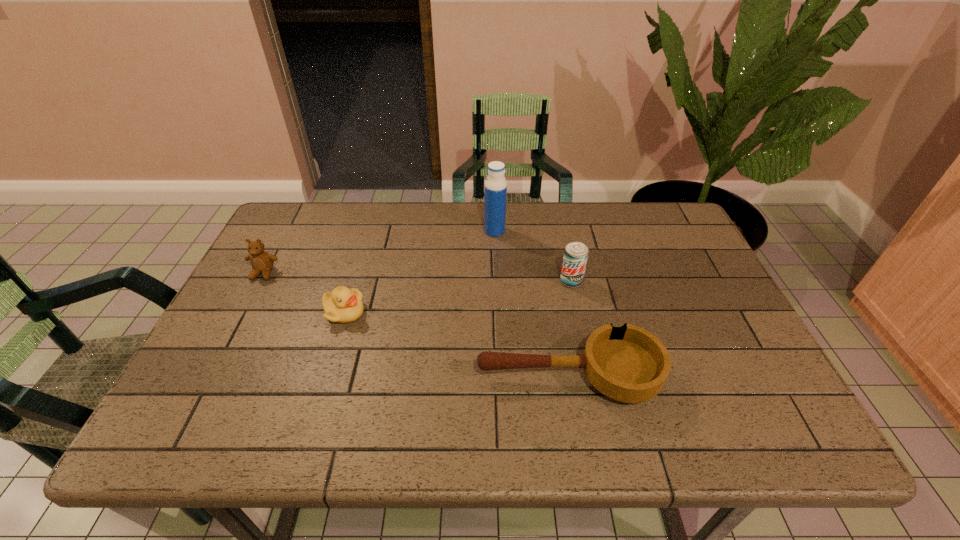
At what (x,y) coordinates should I click in order to perform the action: click on blank area at the right edge. Please return your answer as a coordinate pair (x, y). Looking at the image, I should click on (694, 301).

This screenshot has width=960, height=540. In the image, there is a desktop. Find the location of `free space at the far left corner`. free space at the far left corner is located at coordinates (330, 210).

Where is `vacant space at the near left corner of the desktop`? The image size is (960, 540). vacant space at the near left corner of the desktop is located at coordinates (228, 423).

Where is `vacant space at the far right corner of the desktop`? The height and width of the screenshot is (540, 960). vacant space at the far right corner of the desktop is located at coordinates (639, 239).

Locate an element on the screen. unoccupied position between the teddy bear and the nearest object is located at coordinates (416, 325).

Find the location of `free spot between the duckling and the beer can`. free spot between the duckling and the beer can is located at coordinates (458, 297).

The height and width of the screenshot is (540, 960). What are the coordinates of `free space between the fourth object from right to left and the leftmost object` in the screenshot? It's located at (304, 293).

This screenshot has width=960, height=540. What are the coordinates of `vacant area that lies between the fourth object from right to left and the beer can` in the screenshot? It's located at (458, 297).

Find the location of `empty space between the nearest object and the beer can`. empty space between the nearest object and the beer can is located at coordinates click(x=569, y=329).

You are a GUI agent. You are given a task and a screenshot of the screen. Output one action in this format:
    pyautogui.click(x=<x>, y=<y>)
    Task: Click on the free space between the beer can and the tallest object
    
    Given the screenshot: What is the action you would take?
    point(533,256)